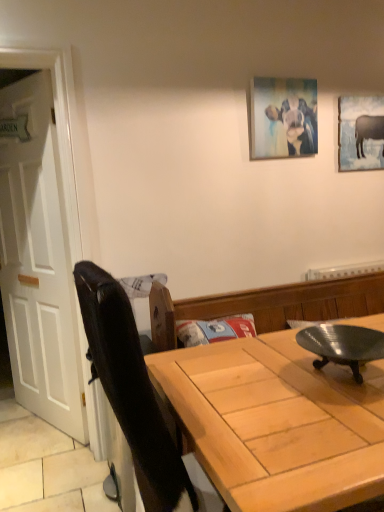
Locate an element on the screen. The width and height of the screenshot is (384, 512). free point behind metallic silver plate at center is located at coordinates [279, 344].